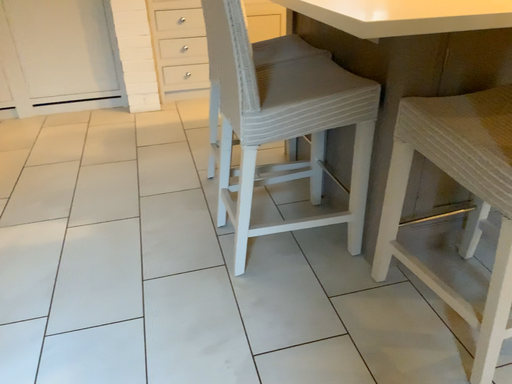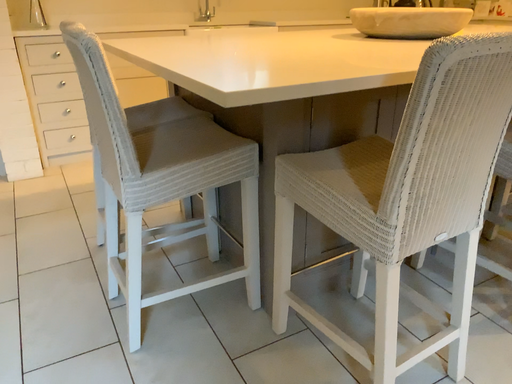
Question: How did the camera likely rotate when shooting the video?

Choices:
 (A) rotated downward
 (B) rotated upward

Answer: (B)